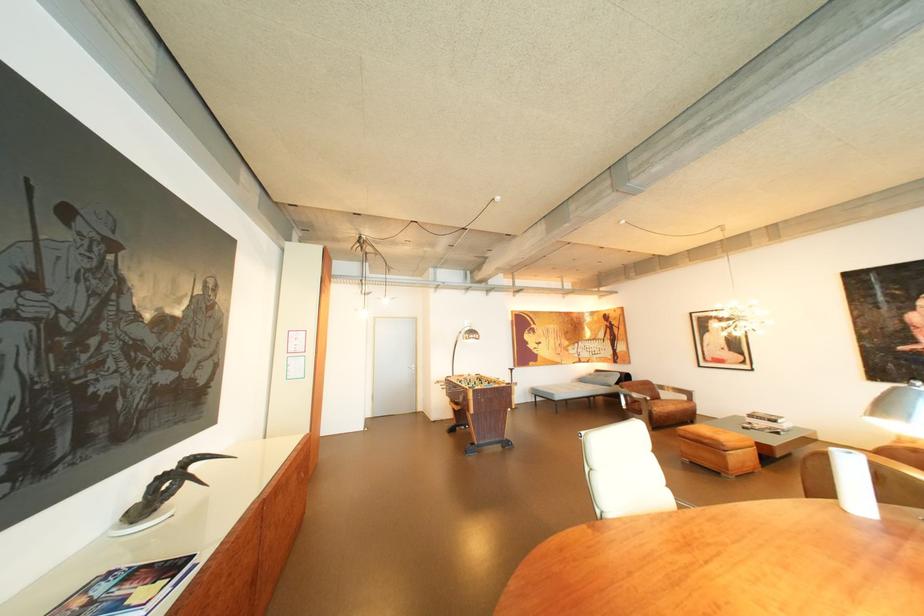
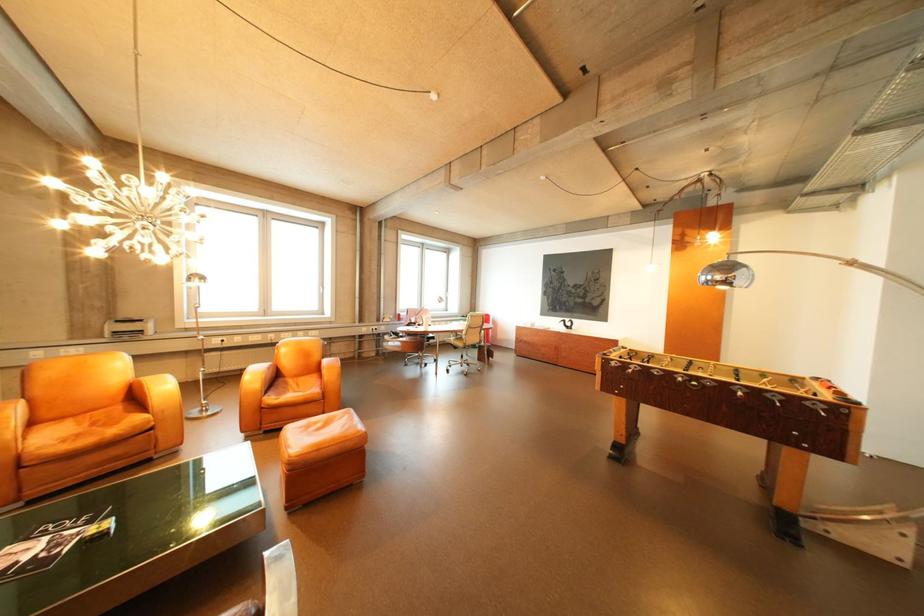
The point at (176, 477) is marked in the first image. Where is the corresponding point in the second image?

(578, 322)